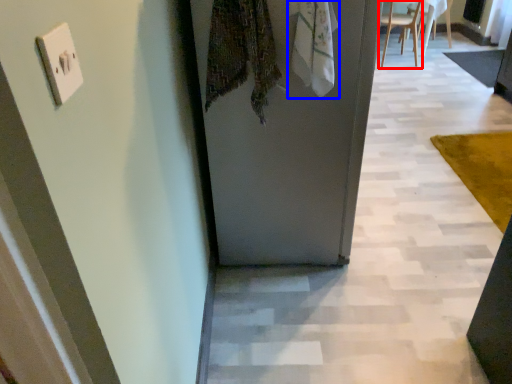
Question: Which object is further to the camera taking this photo, chair (highlighted by a red box) or scarf (highlighted by a blue box)?

Choices:
 (A) chair
 (B) scarf

Answer: (A)